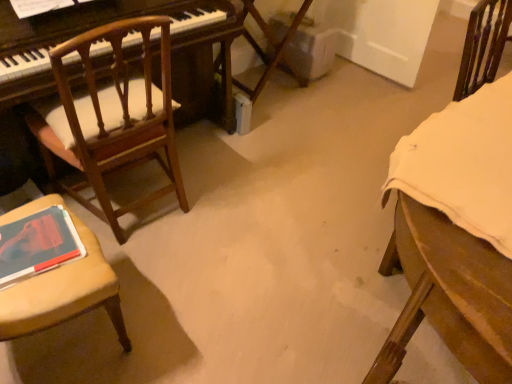
Question: From a real-world perspective, does wooden chair with cushion at left, arranged as the 2th chair when viewed from the right, stand above matte red book at lower left?

Choices:
 (A) yes
 (B) no

Answer: (B)

Question: Would you say matte red book at lower left is part of wooden chair with cushion at left, marked as the 2th chair in a left-to-right arrangement,'s contents?

Choices:
 (A) yes
 (B) no

Answer: (B)

Question: Does wooden chair with cushion at left, arranged as the 2th chair when viewed from the right, have a lesser width compared to matte red book at lower left?

Choices:
 (A) no
 (B) yes

Answer: (A)

Question: Is wooden chair with cushion at left, marked as the 2th chair in a left-to-right arrangement, facing away from matte red book at lower left?

Choices:
 (A) yes
 (B) no

Answer: (B)

Question: Does wooden chair with cushion at left, arranged as the 2th chair when viewed from the right, have a greater width compared to matte red book at lower left?

Choices:
 (A) no
 (B) yes

Answer: (B)

Question: Considering the positions of wooden chair with cushion at left, which is the 1th chair in left-to-right order, and matte red book at lower left in the image, is wooden chair with cushion at left, which is the 1th chair in left-to-right order, bigger or smaller than matte red book at lower left?

Choices:
 (A) small
 (B) big

Answer: (B)

Question: Considering the positions of point (4, 357) and point (29, 223), is point (4, 357) closer or farther from the camera than point (29, 223)?

Choices:
 (A) farther
 (B) closer

Answer: (A)

Question: In terms of width, does wooden chair with cushion at left, the 3th chair in the right-to-left sequence, look wider or thinner when compared to matte red book at lower left?

Choices:
 (A) thin
 (B) wide

Answer: (B)

Question: Choose the correct answer: Is wooden chair with cushion at left, the 3th chair in the right-to-left sequence, inside matte red book at lower left or outside it?

Choices:
 (A) outside
 (B) inside

Answer: (A)

Question: Do you think matte red book at lower left is within wooden chair at right, which appears as the third chair when viewed from the left, or outside of it?

Choices:
 (A) outside
 (B) inside

Answer: (A)

Question: From their relative heights in the image, would you say matte red book at lower left is taller or shorter than wooden chair at right, which appears as the third chair when viewed from the left?

Choices:
 (A) short
 (B) tall

Answer: (A)

Question: From a real-world perspective, relative to wooden chair at right, which appears as the third chair when viewed from the left, is matte red book at lower left vertically above or below?

Choices:
 (A) below
 (B) above

Answer: (B)

Question: From the image's perspective, is matte red book at lower left positioned above or below wooden chair at right, which appears as the third chair when viewed from the left?

Choices:
 (A) above
 (B) below

Answer: (B)

Question: Considering the positions of wooden chair at right, which appears as the third chair when viewed from the left, and matte red book at lower left in the image, is wooden chair at right, which appears as the third chair when viewed from the left, wider or thinner than matte red book at lower left?

Choices:
 (A) thin
 (B) wide

Answer: (B)

Question: Based on their positions, is wooden chair at right, which appears as the third chair when viewed from the left, located to the left or right of matte red book at lower left?

Choices:
 (A) left
 (B) right

Answer: (B)